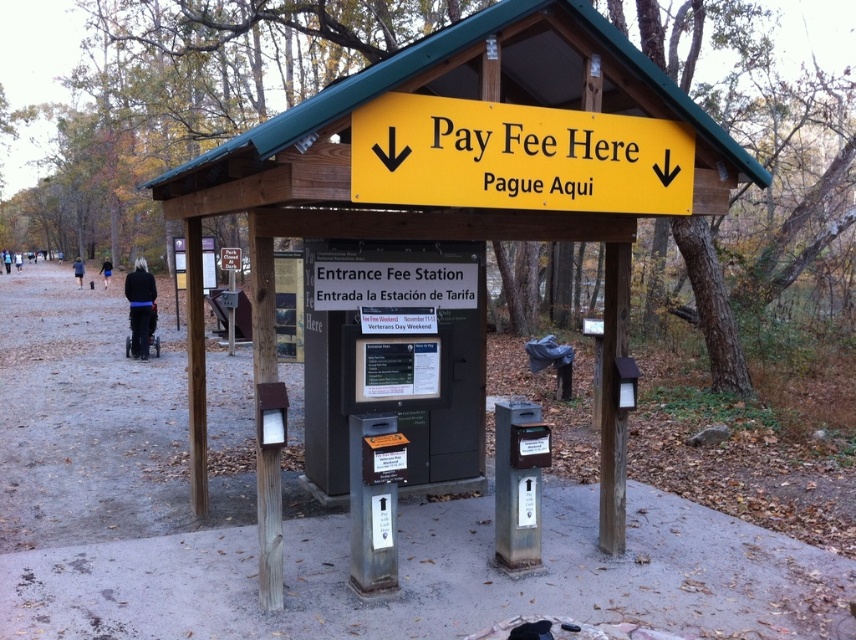
In the scene shown: Does wooden sign at center have a lesser width compared to yellow matte sign at center?

No.

In the scene shown: Which is below, wooden sign at center or yellow matte sign at center?

Positioned lower is yellow matte sign at center.

Between point (259, 465) and point (456, 122), which one is positioned behind?

Positioned behind is point (259, 465).

This screenshot has width=856, height=640. I want to click on wooden sign at center, so click(435, 205).